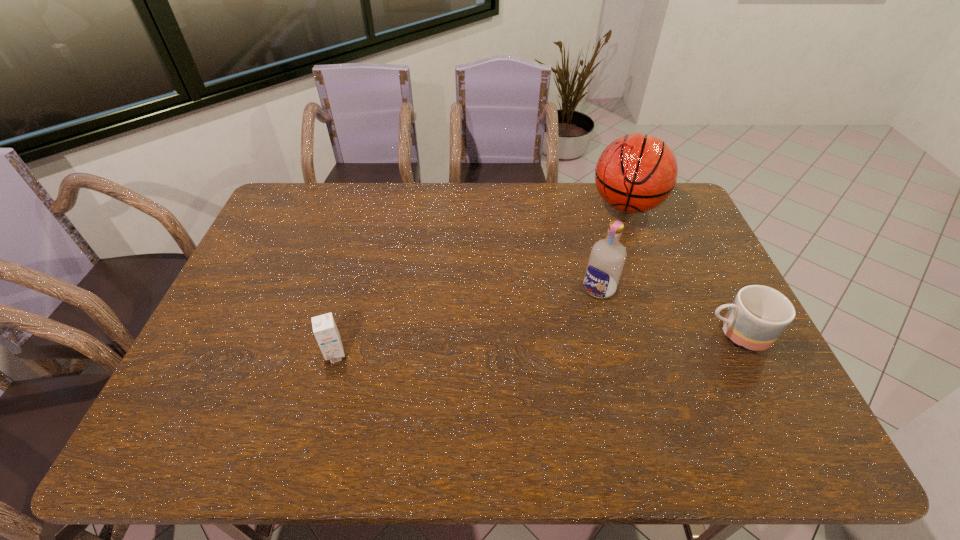
You are a GUI agent. You are given a task and a screenshot of the screen. Output one action in this format:
    pyautogui.click(x=<x>, y=<y>)
    Task: Click on the free space in the image that satisfies the following two spatial constraints: 1. on the front side of the farthest object; 2. on the side with the handle of the shortest object
    
    Given the screenshot: What is the action you would take?
    pyautogui.click(x=675, y=334)

Image resolution: width=960 pixels, height=540 pixels. I want to click on vacant region that satisfies the following two spatial constraints: 1. on the back side of the leftmost object; 2. on the side with the handle of the mug, so click(x=342, y=334).

In order to click on vacant space that satisfies the following two spatial constraints: 1. on the back side of the leftmost object; 2. on the side with the handle of the mug in this screenshot , I will do `click(342, 334)`.

Find the location of a particular element. free space in the image that satisfies the following two spatial constraints: 1. on the back side of the basketball; 2. on the left side of the vodka is located at coordinates (578, 206).